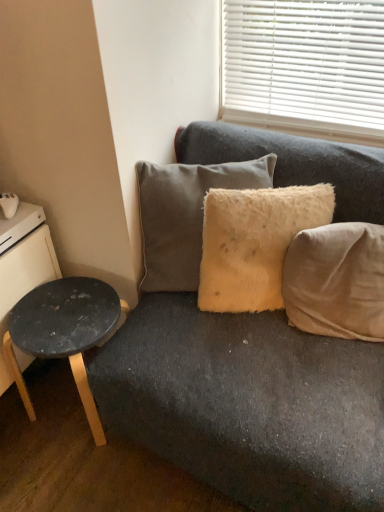
The height and width of the screenshot is (512, 384). Describe the element at coordinates (254, 243) in the screenshot. I see `fuzzy yellow pillow at center, the 2th pillow when ordered from right to left` at that location.

Measure the distance between black wood dresser at left and camera.

They are 1.28 meters apart.

The image size is (384, 512). What do you see at coordinates (22, 266) in the screenshot? I see `black wood dresser at left` at bounding box center [22, 266].

At what (x,y) coordinates should I click in order to perform the action: click on matte black stool at lower left. Please return your answer as a coordinate pair (x, y). The height and width of the screenshot is (512, 384). Looking at the image, I should click on (63, 332).

What do you see at coordinates (19, 224) in the screenshot?
I see `white glossy drawer at left` at bounding box center [19, 224].

Where is `fuzzy beige pillow at center, which is the third pillow in right-to-left order`? The width and height of the screenshot is (384, 512). fuzzy beige pillow at center, which is the third pillow in right-to-left order is located at coordinates (185, 215).

You are a GUI agent. You are given a task and a screenshot of the screen. Output one action in this format:
    pyautogui.click(x=<x>, y=<y>)
    Task: Click on the fuzzy yellow pillow at center, marked as the 2th pillow in a left-to-right arrangement
    Image resolution: width=384 pixels, height=512 pixels.
    Given the screenshot: What is the action you would take?
    pyautogui.click(x=254, y=243)

Are beige fabric pillow at right, acting as the 3th pillow starting from the left, and matte black stool at lower left far apart?

Actually, beige fabric pillow at right, acting as the 3th pillow starting from the left, and matte black stool at lower left are a little close together.

Which object is closer to the camera taking this photo, beige fabric pillow at right, acting as the 3th pillow starting from the left, or matte black stool at lower left?

beige fabric pillow at right, acting as the 3th pillow starting from the left, is more forward.

Is white glossy drawer at left touching beige fabric pillow at right, acting as the 3th pillow starting from the left?

No, white glossy drawer at left is not beside beige fabric pillow at right, acting as the 3th pillow starting from the left.

Between white glossy drawer at left and beige fabric pillow at right, acting as the 3th pillow starting from the left, which one has smaller width?

Thinner between the two is beige fabric pillow at right, acting as the 3th pillow starting from the left.

How much distance is there between white glossy drawer at left and beige fabric pillow at right, which is counted as the 1th pillow, starting from the right?

white glossy drawer at left is 37.05 inches away from beige fabric pillow at right, which is counted as the 1th pillow, starting from the right.

From a real-world perspective, is white glossy drawer at left located higher than beige fabric pillow at right, acting as the 3th pillow starting from the left?

Yes, from a real-world perspective, white glossy drawer at left is over beige fabric pillow at right, acting as the 3th pillow starting from the left

In the image, is fuzzy yellow pillow at center, the 2th pillow when ordered from right to left, positioned in front of or behind white glossy drawer at left?

Clearly, fuzzy yellow pillow at center, the 2th pillow when ordered from right to left, is in front of white glossy drawer at left.

Locate an element on the screen. drawer above the fuzzy yellow pillow at center, the 2th pillow when ordered from right to left (from a real-world perspective) is located at coordinates (19, 224).

From the image's perspective, which object appears higher, fuzzy yellow pillow at center, the 2th pillow when ordered from right to left, or white glossy drawer at left?

From the image's view, white glossy drawer at left is above.

From a real-world perspective, is fuzzy yellow pillow at center, marked as the 2th pillow in a left-to-right arrangement, located beneath white glossy drawer at left?

Yes, from a real-world perspective, fuzzy yellow pillow at center, marked as the 2th pillow in a left-to-right arrangement, is below white glossy drawer at left.

Is beige fabric pillow at right, which is counted as the 1th pillow, starting from the right, oriented towards fuzzy beige pillow at center, which is the third pillow in right-to-left order?

No, beige fabric pillow at right, which is counted as the 1th pillow, starting from the right, is not aimed at fuzzy beige pillow at center, which is the third pillow in right-to-left order.

Is beige fabric pillow at right, which is counted as the 1th pillow, starting from the right, to the right of fuzzy beige pillow at center, which is the third pillow in right-to-left order, from the viewer's perspective?

Correct, you'll find beige fabric pillow at right, which is counted as the 1th pillow, starting from the right, to the right of fuzzy beige pillow at center, which is the third pillow in right-to-left order.

From a real-world perspective, is black wood dresser at left over fuzzy yellow pillow at center, marked as the 2th pillow in a left-to-right arrangement?

No.

Is black wood dresser at left completely or partially outside of fuzzy yellow pillow at center, the 2th pillow when ordered from right to left?

Yes, black wood dresser at left is outside of fuzzy yellow pillow at center, the 2th pillow when ordered from right to left.

How much distance is there between black wood dresser at left and fuzzy yellow pillow at center, marked as the 2th pillow in a left-to-right arrangement?

black wood dresser at left is 65.96 centimeters from fuzzy yellow pillow at center, marked as the 2th pillow in a left-to-right arrangement.

Which is behind, point (27, 242) or point (303, 193)?

Positioned behind is point (27, 242).

Which object is positioned more to the right, beige fabric pillow at right, which is counted as the 1th pillow, starting from the right, or white glossy drawer at left?

From the viewer's perspective, beige fabric pillow at right, which is counted as the 1th pillow, starting from the right, appears more on the right side.

This screenshot has width=384, height=512. I want to click on pillow that is the 3rd object to the right of the white glossy drawer at left, starting at the anchor, so 336,281.

From a real-world perspective, which object stands above the other?

In real-world perspective, white glossy drawer at left is above.

Do you think fuzzy yellow pillow at center, marked as the 2th pillow in a left-to-right arrangement, is within black wood dresser at left, or outside of it?

fuzzy yellow pillow at center, marked as the 2th pillow in a left-to-right arrangement, is outside black wood dresser at left.

Considering the relative sizes of fuzzy yellow pillow at center, marked as the 2th pillow in a left-to-right arrangement, and black wood dresser at left in the image provided, is fuzzy yellow pillow at center, marked as the 2th pillow in a left-to-right arrangement, thinner than black wood dresser at left?

Indeed, fuzzy yellow pillow at center, marked as the 2th pillow in a left-to-right arrangement, has a lesser width compared to black wood dresser at left.

Is point (248, 201) closer or farther from the camera than point (54, 274)?

Point (248, 201) appears to be closer to the viewer than point (54, 274).

You are a GUI agent. You are given a task and a screenshot of the screen. Output one action in this format:
    pyautogui.click(x=<x>, y=<y>)
    Task: Click on the table that is below the beige fabric pillow at right, acting as the 3th pillow starting from the left (from the image's perspective)
    This screenshot has width=384, height=512.
    Given the screenshot: What is the action you would take?
    pyautogui.click(x=63, y=332)

The height and width of the screenshot is (512, 384). Find the location of `drawer above the beige fabric pillow at right, which is counted as the 1th pillow, starting from the right (from the image's perspective)`. drawer above the beige fabric pillow at right, which is counted as the 1th pillow, starting from the right (from the image's perspective) is located at coordinates (19, 224).

Considering their positions, is black wood dresser at left positioned further to fuzzy beige pillow at center, marked as the first pillow in a left-to-right arrangement, than beige fabric pillow at right, which is counted as the 1th pillow, starting from the right?

black wood dresser at left is further to fuzzy beige pillow at center, marked as the first pillow in a left-to-right arrangement.

Based on their spatial positions, is black wood dresser at left or beige fabric pillow at right, acting as the 3th pillow starting from the left, further from fuzzy yellow pillow at center, the 2th pillow when ordered from right to left?

Among the two, black wood dresser at left is located further to fuzzy yellow pillow at center, the 2th pillow when ordered from right to left.

Looking at this image, looking at the image, which one is located closer to beige fabric pillow at right, acting as the 3th pillow starting from the left, black wood dresser at left or fuzzy yellow pillow at center, marked as the 2th pillow in a left-to-right arrangement?

fuzzy yellow pillow at center, marked as the 2th pillow in a left-to-right arrangement, lies closer to beige fabric pillow at right, acting as the 3th pillow starting from the left, than the other object.

When comparing their distances from fuzzy beige pillow at center, which is the third pillow in right-to-left order, does fuzzy yellow pillow at center, marked as the 2th pillow in a left-to-right arrangement, or beige fabric pillow at right, acting as the 3th pillow starting from the left, seem further?

Among the two, beige fabric pillow at right, acting as the 3th pillow starting from the left, is located further to fuzzy beige pillow at center, which is the third pillow in right-to-left order.

Considering their positions, is white glossy drawer at left positioned closer to matte black stool at lower left than fuzzy beige pillow at center, which is the third pillow in right-to-left order?

The object closer to matte black stool at lower left is white glossy drawer at left.

When comparing their distances from matte black stool at lower left, does beige fabric pillow at right, which is counted as the 1th pillow, starting from the right, or fuzzy beige pillow at center, marked as the first pillow in a left-to-right arrangement, seem further?

beige fabric pillow at right, which is counted as the 1th pillow, starting from the right, lies further to matte black stool at lower left than the other object.

In the scene shown: Looking at the image, which one is located further to beige fabric pillow at right, acting as the 3th pillow starting from the left, matte black stool at lower left or fuzzy yellow pillow at center, the 2th pillow when ordered from right to left?

The object further to beige fabric pillow at right, acting as the 3th pillow starting from the left, is matte black stool at lower left.

From the image, which object appears to be nearer to fuzzy yellow pillow at center, the 2th pillow when ordered from right to left, black wood dresser at left or fuzzy beige pillow at center, which is the third pillow in right-to-left order?

fuzzy beige pillow at center, which is the third pillow in right-to-left order, is positioned closer to the anchor fuzzy yellow pillow at center, the 2th pillow when ordered from right to left.

I want to click on table between white glossy drawer at left and fuzzy yellow pillow at center, marked as the 2th pillow in a left-to-right arrangement, so tap(63, 332).

Locate an element on the screen. drawer between black wood dresser at left and fuzzy beige pillow at center, which is the third pillow in right-to-left order is located at coordinates (19, 224).

You are a GUI agent. You are given a task and a screenshot of the screen. Output one action in this format:
    pyautogui.click(x=<x>, y=<y>)
    Task: Click on the table between black wood dresser at left and beige fabric pillow at right, acting as the 3th pillow starting from the left, in the horizontal direction
    This screenshot has height=512, width=384.
    Given the screenshot: What is the action you would take?
    (63, 332)

Identify the location of drawer between black wood dresser at left and beige fabric pillow at right, acting as the 3th pillow starting from the left. Image resolution: width=384 pixels, height=512 pixels. coord(19,224).